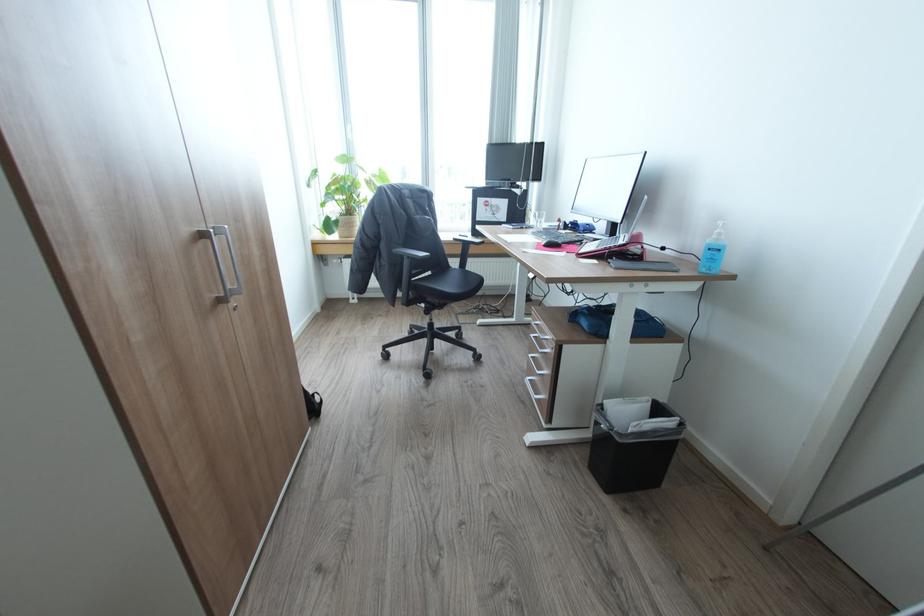
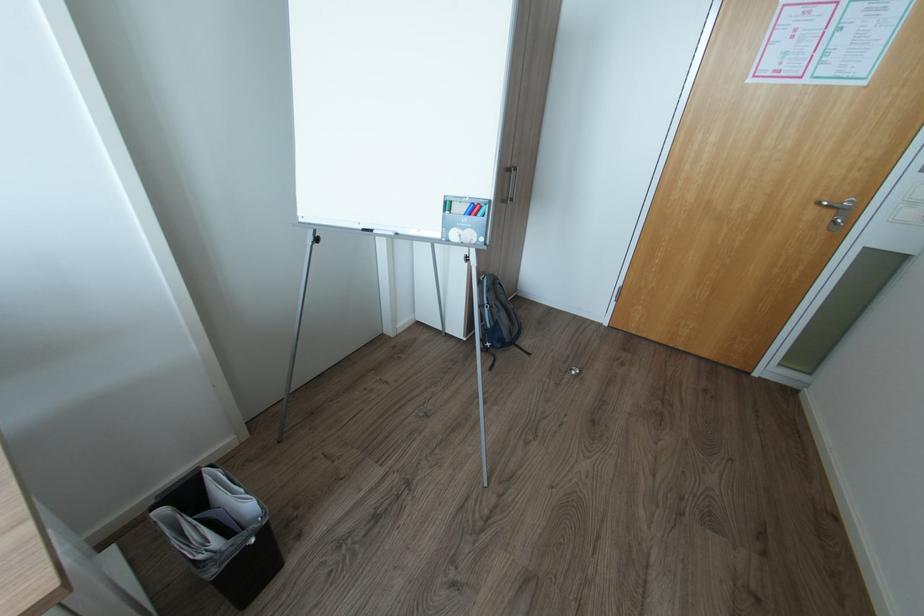
Find the pixel in the second image that matches (x=608, y=426) in the first image.

(257, 541)